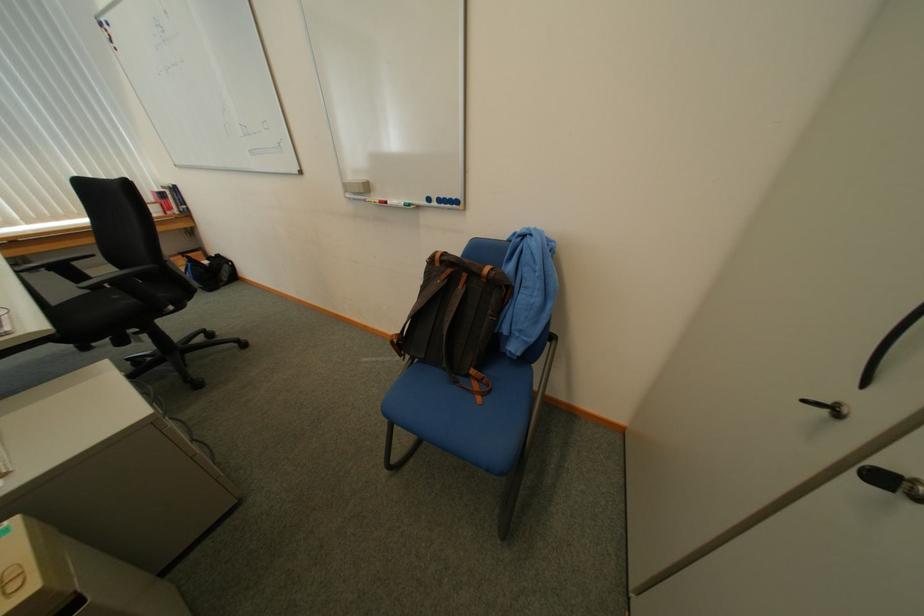
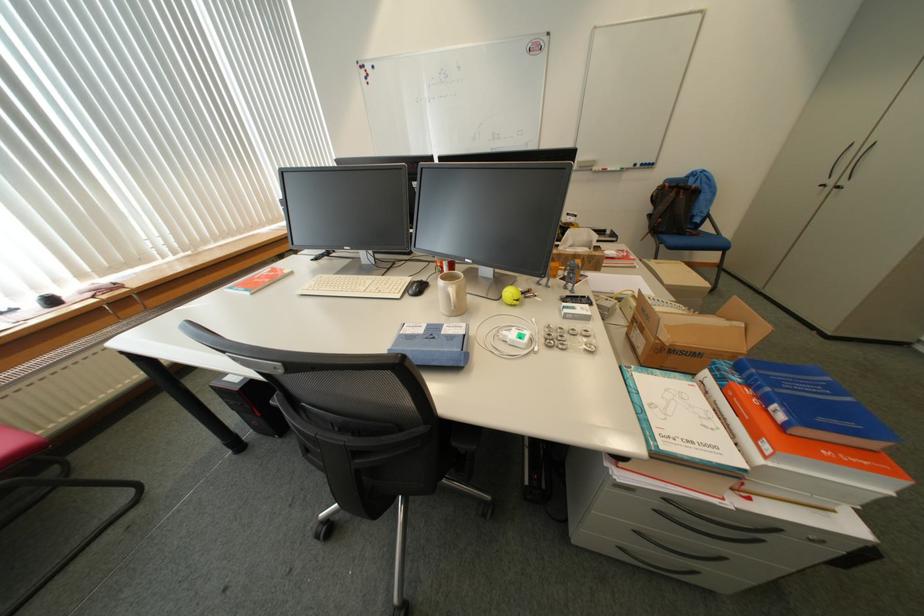
The point at (460, 283) is marked in the first image. Where is the corresponding point in the second image?

(687, 195)